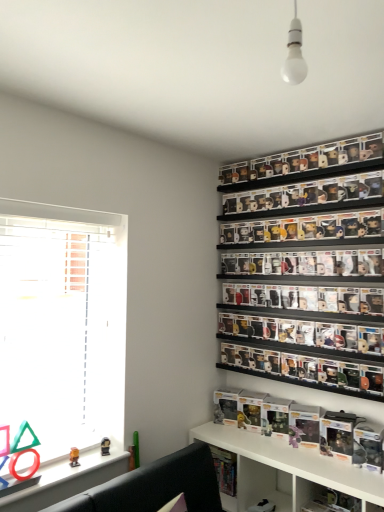
Describe the element at coordinates (301, 162) in the screenshot. I see `clear plastic figures at upper right, placed as the first shelf when sorted from top to bottom` at that location.

The image size is (384, 512). Find the location of `black plastic shelf at center, which is the 3th shelf from top to bottom`. black plastic shelf at center, which is the 3th shelf from top to bottom is located at coordinates (296, 380).

This screenshot has height=512, width=384. I want to click on white glossy bulb at upper center, so click(x=294, y=54).

The width and height of the screenshot is (384, 512). In order to click on hardcover book at lower center in this screenshot , I will do click(225, 469).

Image resolution: width=384 pixels, height=512 pixels. What do you see at coordinates (304, 335) in the screenshot?
I see `black matte pop vinyl figures at center, the second shelf from the top` at bounding box center [304, 335].

Locate an element on the screen. The height and width of the screenshot is (512, 384). clear plastic figures at upper right, which is counted as the 4th shelf, starting from the bottom is located at coordinates click(x=301, y=162).

Considering the relative sizes of white glossy shelf at lower center, marked as the 4th shelf in a top-to-bottom arrangement, and white glossy bulb at upper center in the image provided, is white glossy shelf at lower center, marked as the 4th shelf in a top-to-bottom arrangement, taller than white glossy bulb at upper center?

Yes.

Could white glossy bulb at upper center be considered to be inside white glossy shelf at lower center, marked as the 4th shelf in a top-to-bottom arrangement?

No.

Does point (258, 451) come farther from viewer compared to point (288, 42)?

That is True.

Can you confirm if white glossy shelf at lower center, marked as the 4th shelf in a top-to-bottom arrangement, is thinner than white glossy bulb at upper center?

In fact, white glossy shelf at lower center, marked as the 4th shelf in a top-to-bottom arrangement, might be wider than white glossy bulb at upper center.

Is white matte window at left a part of matte orange toy at lower left?

That's incorrect, white matte window at left is not inside matte orange toy at lower left.

Is matte orange toy at lower left turned away from white matte window at left?

Yes, white matte window at left is at the back of matte orange toy at lower left.

Is matte orange toy at lower left further to camera compared to white matte window at left?

Yes, it is behind white matte window at left.

In terms of height, does matte orange toy at lower left look taller or shorter compared to white matte window at left?

matte orange toy at lower left is shorter than white matte window at left.

Between white glossy cabinet at lower right and hardcover book at lower center, which one is positioned in front?

white glossy cabinet at lower right is closer to the camera.

Which of these two, white glossy cabinet at lower right or hardcover book at lower center, is bigger?

With larger size is hardcover book at lower center.

Is point (317, 487) behind point (226, 467)?

No.

Can you confirm if black plastic shelf at center, which is the 3th shelf from top to bottom, is shorter than white matte window at left?

Yes, black plastic shelf at center, which is the 3th shelf from top to bottom, is shorter than white matte window at left.

From the image's perspective, would you say black plastic shelf at center, which is the 3th shelf from top to bottom, is shown under white matte window at left?

Correct, black plastic shelf at center, which is the 3th shelf from top to bottom, appears lower than white matte window at left in the image.

Is black plastic shelf at center, which is the 3th shelf from top to bottom, not close to white matte window at left?

Indeed, black plastic shelf at center, which is the 3th shelf from top to bottom, is not near white matte window at left.

Can we say black plastic shelf at center, which is the 3th shelf from top to bottom, lies outside white matte window at left?

Yes, black plastic shelf at center, which is the 3th shelf from top to bottom, is not within white matte window at left.

From the image's perspective, is white glossy bulb at upper center located beneath white glossy cabinet at lower right?

No, from the image's perspective, white glossy bulb at upper center is not below white glossy cabinet at lower right.

From the picture: From a real-world perspective, relative to white glossy cabinet at lower right, is white glossy bulb at upper center vertically above or below?

white glossy bulb at upper center is above white glossy cabinet at lower right.

Considering the relative sizes of white glossy bulb at upper center and white glossy cabinet at lower right in the image provided, is white glossy bulb at upper center wider than white glossy cabinet at lower right?

Incorrect, the width of white glossy bulb at upper center does not surpass that of white glossy cabinet at lower right.

Which of these two, white glossy bulb at upper center or white glossy cabinet at lower right, stands taller?

With more height is white glossy bulb at upper center.

Can you confirm if white glossy bulb at upper center is thinner than matte orange toy at lower left?

No, white glossy bulb at upper center is not thinner than matte orange toy at lower left.

Considering the positions of objects white glossy bulb at upper center and matte orange toy at lower left in the image provided, who is more to the left, white glossy bulb at upper center or matte orange toy at lower left?

matte orange toy at lower left is more to the left.

Is point (290, 30) behind point (72, 458)?

No, it is not.

Is hardcover book at lower center at the back of white glossy bulb at upper center?

That's not correct — white glossy bulb at upper center is not looking away from hardcover book at lower center.

Is white glossy bulb at upper center touching hardcover book at lower center?

No, white glossy bulb at upper center is not with hardcover book at lower center.

Which object is positioned more to the right, white glossy bulb at upper center or hardcover book at lower center?

white glossy bulb at upper center is more to the right.

From the image's perspective, relative to hardcover book at lower center, is white glossy bulb at upper center above or below?

white glossy bulb at upper center is above hardcover book at lower center.

Where is `shelf that is the 4th object directly below the white glossy bulb at upper center (from a real-world perspective)`? The width and height of the screenshot is (384, 512). shelf that is the 4th object directly below the white glossy bulb at upper center (from a real-world perspective) is located at coordinates (285, 469).

Where is `toy lying on the right of white matte window at left`? The width and height of the screenshot is (384, 512). toy lying on the right of white matte window at left is located at coordinates (74, 457).

Based on their spatial positions, is black plastic shelf at center, the second shelf when ordered from bottom to top, or black matte pop vinyl figures at center, the second shelf from the top, further from white glossy cabinet at lower right?

black matte pop vinyl figures at center, the second shelf from the top.

Looking at the image, which one is located further to white glossy bulb at upper center, white glossy cabinet at lower right or matte orange toy at lower left?

Among the two, matte orange toy at lower left is located further to white glossy bulb at upper center.

When comparing their distances from black plastic shelf at center, which is the 3th shelf from top to bottom, does white glossy bulb at upper center or white glossy shelf at lower center, marked as the 4th shelf in a top-to-bottom arrangement, seem further?

Based on the image, white glossy bulb at upper center appears to be further to black plastic shelf at center, which is the 3th shelf from top to bottom.

Considering their positions, is white glossy bulb at upper center positioned closer to black matte pop vinyl figures at center, the second shelf from the top, than white matte window at left?

white matte window at left lies closer to black matte pop vinyl figures at center, the second shelf from the top, than the other object.

When comparing their distances from clear plastic figures at upper right, placed as the first shelf when sorted from top to bottom, does black plastic shelf at center, which is the 3th shelf from top to bottom, or white glossy bulb at upper center seem further?

Based on the image, white glossy bulb at upper center appears to be further to clear plastic figures at upper right, placed as the first shelf when sorted from top to bottom.

Looking at the image, which one is located closer to black plastic shelf at center, the second shelf when ordered from bottom to top, clear plastic figures at upper right, which is counted as the 4th shelf, starting from the bottom, or hardcover book at lower center?

The object closer to black plastic shelf at center, the second shelf when ordered from bottom to top, is hardcover book at lower center.

Considering their positions, is white glossy shelf at lower center, marked as the 4th shelf in a top-to-bottom arrangement, positioned further to white glossy bulb at upper center than matte orange toy at lower left?

matte orange toy at lower left is positioned further to the anchor white glossy bulb at upper center.

Consider the image. Which object lies further to the anchor point white glossy bulb at upper center, matte orange toy at lower left or clear plastic figures at upper right, placed as the first shelf when sorted from top to bottom?

Based on the image, matte orange toy at lower left appears to be further to white glossy bulb at upper center.

In order to click on toy situated between white matte window at left and black matte pop vinyl figures at center, placed as the 3th shelf when sorted from bottom to top, from left to right in this screenshot , I will do `click(74, 457)`.

Find the location of a particular element. The width and height of the screenshot is (384, 512). toy between white matte window at left and black plastic shelf at center, the second shelf when ordered from bottom to top is located at coordinates (74, 457).

Where is `window that lies between white glossy bulb at upper center and white glossy cabinet at lower right from top to bottom`? Image resolution: width=384 pixels, height=512 pixels. window that lies between white glossy bulb at upper center and white glossy cabinet at lower right from top to bottom is located at coordinates (62, 324).

Locate an element on the screen. The width and height of the screenshot is (384, 512). window between white glossy bulb at upper center and matte orange toy at lower left from top to bottom is located at coordinates (62, 324).